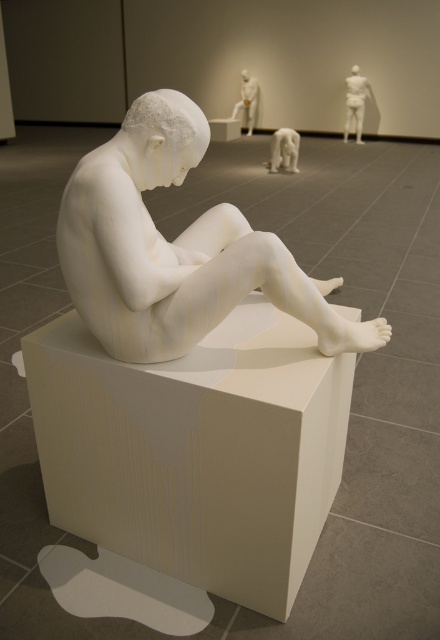
Question: Among these objects, which one is farthest from the camera?

Choices:
 (A) white matte sculpture at center
 (B) white matte torso at upper right

Answer: (B)

Question: Among these points, which one is nearest to the camera?

Choices:
 (A) (337, 348)
 (B) (59, 518)
 (C) (242, 90)
 (D) (344, 122)

Answer: (A)

Question: Can you confirm if white matte torso at upper right is smaller than white glossy statue at upper center?

Choices:
 (A) no
 (B) yes

Answer: (B)

Question: Which point is closer to the camera?

Choices:
 (A) white matte torso at upper right
 (B) white matte sculpture at center
 (C) white glossy statue at upper center

Answer: (B)

Question: Does white matte torso at upper right appear on the right side of white glossy statue at upper center?

Choices:
 (A) no
 (B) yes

Answer: (B)

Question: Is white matte cube at center above white glossy bear at center?

Choices:
 (A) no
 (B) yes

Answer: (A)